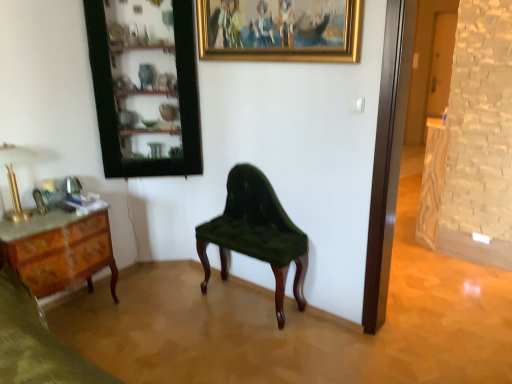
Describe the element at coordinates (145, 86) in the screenshot. This screenshot has height=384, width=512. I see `wooden cabinet at upper left` at that location.

Measure the distance between point (x=141, y=137) and camera.

A distance of 9.51 feet exists between point (x=141, y=137) and camera.

What do you see at coordinates (256, 233) in the screenshot? This screenshot has height=384, width=512. I see `velvet green chair at center` at bounding box center [256, 233].

This screenshot has width=512, height=384. What do you see at coordinates (61, 252) in the screenshot?
I see `marble top wood desk at left` at bounding box center [61, 252].

Describe the element at coordinates (14, 179) in the screenshot. I see `gold polished metal lamp at left` at that location.

Locate an element on the screen. gold/golden frame at upper center is located at coordinates (280, 30).

Is gold/golden frame at upper center inside or outside of gold polished metal lamp at left?

gold/golden frame at upper center is not enclosed by gold polished metal lamp at left.

Is gold/golden frame at upper center beside gold polished metal lamp at left?

There is a gap between gold/golden frame at upper center and gold polished metal lamp at left.

From a real-world perspective, is gold/golden frame at upper center physically above gold polished metal lamp at left?

Yes, from a real-world perspective, gold/golden frame at upper center is over gold polished metal lamp at left

Is gold/golden frame at upper center to the left of gold polished metal lamp at left from the viewer's perspective?

In fact, gold/golden frame at upper center is to the right of gold polished metal lamp at left.

Can you tell me how much wooden cabinet at upper left and gold/golden frame at upper center differ in facing direction?

The angular difference between wooden cabinet at upper left and gold/golden frame at upper center is 43.8 degrees.

Which is closer to the camera, (x=160, y=57) or (x=353, y=24)?

Clearly, point (x=160, y=57) is more distant from the camera than point (x=353, y=24).

Is wooden cabinet at upper left turned away from gold/golden frame at upper center?

No, gold/golden frame at upper center is not at the back of wooden cabinet at upper left.

From the image's perspective, is wooden cabinet at upper left located above or below gold/golden frame at upper center?

Clearly, from the image's perspective, wooden cabinet at upper left is below gold/golden frame at upper center.

This screenshot has width=512, height=384. Find the location of `chair lying behind the marble top wood desk at left`. chair lying behind the marble top wood desk at left is located at coordinates (256, 233).

From the image's perspective, which object appears higher, marble top wood desk at left or velvet green chair at center?

From the image's view, velvet green chair at center is above.

Is marble top wood desk at left situated inside velvet green chair at center or outside?

The correct answer is: outside.

From the image's perspective, is wooden cabinet at upper left below marble top wood desk at left?

→ No, from the image's perspective, wooden cabinet at upper left is not below marble top wood desk at left.

Which object is closer to the camera taking this photo, wooden cabinet at upper left or marble top wood desk at left?

marble top wood desk at left is in front.

Is wooden cabinet at upper left aimed at marble top wood desk at left?

No, wooden cabinet at upper left does not turn towards marble top wood desk at left.

In order to click on cabinetry on the right of marble top wood desk at left in this screenshot , I will do `click(145, 86)`.

Is gold/golden frame at upper center facing away from velvet green chair at center?

No, gold/golden frame at upper center is not facing away from velvet green chair at center.

Consider the image. From the image's perspective, which one is positioned lower, gold/golden frame at upper center or velvet green chair at center?

velvet green chair at center.

Where is `picture frame that is above the velvet green chair at center (from the image's perspective)`? picture frame that is above the velvet green chair at center (from the image's perspective) is located at coordinates (280, 30).

Considering the relative positions of gold polished metal lamp at left and marble top wood desk at left in the image provided, is gold polished metal lamp at left to the left of marble top wood desk at left from the viewer's perspective?

Correct, you'll find gold polished metal lamp at left to the left of marble top wood desk at left.

Is gold polished metal lamp at left oriented away from marble top wood desk at left?

gold polished metal lamp at left is not turned away from marble top wood desk at left.

In the scene shown: Would you consider gold polished metal lamp at left to be distant from marble top wood desk at left?

Actually, gold polished metal lamp at left and marble top wood desk at left are a little close together.

From a real-world perspective, is gold polished metal lamp at left over velvet green chair at center?

Yes, from a real-world perspective, gold polished metal lamp at left is over velvet green chair at center

Is gold polished metal lamp at left to the left or to the right of velvet green chair at center in the image?

From the image, it's evident that gold polished metal lamp at left is to the left of velvet green chair at center.

From the image's perspective, between gold polished metal lamp at left and velvet green chair at center, which one is located above?

gold polished metal lamp at left, from the image's perspective.

Is the position of gold polished metal lamp at left less distant than that of velvet green chair at center?

Yes, the depth of gold polished metal lamp at left is less than that of velvet green chair at center.

Where is `lamp located below the gold/golden frame at upper center (from the image's perspective)`? This screenshot has height=384, width=512. lamp located below the gold/golden frame at upper center (from the image's perspective) is located at coordinates (14, 179).

Locate an element on the screen. cabinetry that appears behind the gold/golden frame at upper center is located at coordinates (145, 86).

Which object lies further to the anchor point gold/golden frame at upper center, marble top wood desk at left or velvet green chair at center?

The object further to gold/golden frame at upper center is marble top wood desk at left.

Which object lies further to the anchor point wooden cabinet at upper left, gold/golden frame at upper center or velvet green chair at center?

Among the two, velvet green chair at center is located further to wooden cabinet at upper left.

Considering their positions, is gold/golden frame at upper center positioned closer to gold polished metal lamp at left than wooden cabinet at upper left?

wooden cabinet at upper left is closer to gold polished metal lamp at left.

Based on the photo, estimate the real-world distances between objects in this image. Which object is further from velvet green chair at center, wooden cabinet at upper left or gold polished metal lamp at left?

Among the two, gold polished metal lamp at left is located further to velvet green chair at center.

From the image, which object appears to be nearer to marble top wood desk at left, wooden cabinet at upper left or velvet green chair at center?

The object closer to marble top wood desk at left is wooden cabinet at upper left.

Considering their positions, is marble top wood desk at left positioned further to wooden cabinet at upper left than gold/golden frame at upper center?

The object further to wooden cabinet at upper left is marble top wood desk at left.

Which object lies nearer to the anchor point gold polished metal lamp at left, wooden cabinet at upper left or gold/golden frame at upper center?

wooden cabinet at upper left is closer to gold polished metal lamp at left.

Looking at this image, estimate the real-world distances between objects in this image. Which object is closer to gold polished metal lamp at left, wooden cabinet at upper left or velvet green chair at center?

Based on the image, wooden cabinet at upper left appears to be nearer to gold polished metal lamp at left.

The image size is (512, 384). In order to click on cabinetry between gold/golden frame at upper center and velvet green chair at center in the up-down direction in this screenshot , I will do `click(145, 86)`.

At what (x,y) coordinates should I click in order to perform the action: click on cabinetry located between gold polished metal lamp at left and gold/golden frame at upper center in the left-right direction. Please return your answer as a coordinate pair (x, y). The image size is (512, 384). Looking at the image, I should click on (145, 86).

The height and width of the screenshot is (384, 512). I want to click on chair that lies between gold/golden frame at upper center and marble top wood desk at left from top to bottom, so click(x=256, y=233).

I want to click on desk between gold polished metal lamp at left and velvet green chair at center from left to right, so click(61, 252).